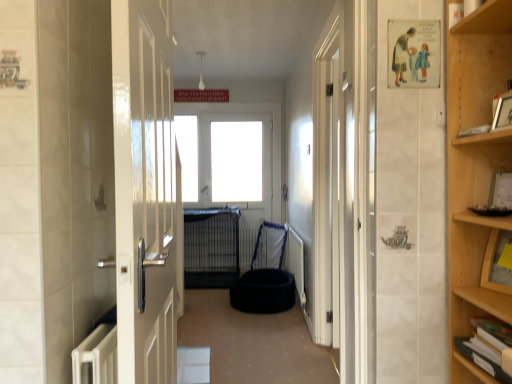
Image resolution: width=512 pixels, height=384 pixels. Identify the location of white glossy door at center. (145, 191).

Measure the distance between point (269,144) and camera.

5.23 meters.

The width and height of the screenshot is (512, 384). In order to click on black fabric bean bag at center in this screenshot , I will do `click(265, 276)`.

What do you see at coordinates (211, 247) in the screenshot?
I see `black wire cage at center` at bounding box center [211, 247].

What do you see at coordinates (263, 291) in the screenshot?
I see `dark blue plush dog bed at center` at bounding box center [263, 291].

Find the location of a particular element. The width and height of the screenshot is (512, 384). white glossy door at center is located at coordinates (145, 191).

Consider the image. From a real-world perspective, between wooden picture frame at upper right and white paper at upper right, marked as the 2th book in a bottom-to-top arrangement, who is vertically higher?

wooden picture frame at upper right.

From the image's perspective, is wooden picture frame at upper right under white paper at upper right, which is counted as the first book, starting from the top?

Incorrect, from the image's perspective, wooden picture frame at upper right is higher than white paper at upper right, which is counted as the first book, starting from the top.

The image size is (512, 384). I want to click on picture frame in front of the white paper at upper right, which is counted as the first book, starting from the top, so click(503, 112).

Can we say white paper at upper right, marked as the 2th book in a bottom-to-top arrangement, lies outside hardcover book at lower right, which is the 1th book from bottom to top?

Indeed, white paper at upper right, marked as the 2th book in a bottom-to-top arrangement, is completely outside hardcover book at lower right, which is the 1th book from bottom to top.

Which is more to the left, white paper at upper right, which is counted as the first book, starting from the top, or hardcover book at lower right, which is the 1th book from bottom to top?

From the viewer's perspective, white paper at upper right, which is counted as the first book, starting from the top, appears more on the left side.

How much distance is there between white paper at upper right, marked as the 2th book in a bottom-to-top arrangement, and hardcover book at lower right, which is the 1th book from bottom to top?

The distance of white paper at upper right, marked as the 2th book in a bottom-to-top arrangement, from hardcover book at lower right, which is the 1th book from bottom to top, is 26.36 inches.

You are a GUI agent. You are given a task and a screenshot of the screen. Output one action in this format:
    pyautogui.click(x=<x>, y=<y>)
    Task: Click on the book below the white paper at upper right, marked as the 2th book in a bottom-to-top arrangement (from a real-world perspective)
    This screenshot has height=384, width=512.
    Given the screenshot: What is the action you would take?
    pyautogui.click(x=487, y=346)

Which is behind, black fabric bean bag at center or hardcover book at lower right, which is the 2th book in top-to-bottom order?

black fabric bean bag at center is further away from the camera.

Which object is thinner, black fabric bean bag at center or hardcover book at lower right, which is the 2th book in top-to-bottom order?

hardcover book at lower right, which is the 2th book in top-to-bottom order.

Considering the positions of objects black fabric bean bag at center and hardcover book at lower right, which is the 2th book in top-to-bottom order, in the image provided, who is more to the left, black fabric bean bag at center or hardcover book at lower right, which is the 2th book in top-to-bottom order,?

black fabric bean bag at center.

From the picture: Do you think black fabric bean bag at center is within hardcover book at lower right, which is the 2th book in top-to-bottom order, or outside of it?

black fabric bean bag at center is located beyond the bounds of hardcover book at lower right, which is the 2th book in top-to-bottom order.

Which is more to the left, black wire cage at center or white glossy window at center?

Positioned to the left is black wire cage at center.

Is black wire cage at center beside white glossy window at center?

No.

Can you confirm if black wire cage at center is thinner than white glossy window at center?

Incorrect, the width of black wire cage at center is not less than that of white glossy window at center.

Between black wire cage at center and white glossy window at center, which one has smaller size?

Smaller between the two is white glossy window at center.

Is black wire cage at center oriented towards white paper at upper right, marked as the 2th book in a bottom-to-top arrangement?

Yes, black wire cage at center is oriented towards white paper at upper right, marked as the 2th book in a bottom-to-top arrangement.

Looking at this image, can you confirm if black wire cage at center is positioned to the left of white paper at upper right, which is counted as the first book, starting from the top?

Indeed, black wire cage at center is positioned on the left side of white paper at upper right, which is counted as the first book, starting from the top.

Is point (189, 239) closer or farther from the camera than point (481, 125)?

Point (189, 239) is positioned farther from the camera compared to point (481, 125).

From the image's perspective, is dark blue plush dog bed at center under wooden picture frame at upper right?

Yes, from the image's perspective, dark blue plush dog bed at center is below wooden picture frame at upper right.

From a real-world perspective, is dark blue plush dog bed at center positioned above or below wooden picture frame at upper right?

dark blue plush dog bed at center is situated lower than wooden picture frame at upper right in the real world.

Is dark blue plush dog bed at center looking in the opposite direction of wooden picture frame at upper right?

dark blue plush dog bed at center does not have its back to wooden picture frame at upper right.

Is point (291, 287) closer to camera compared to point (507, 102)?

No, (291, 287) is further to viewer.

Is white plastic radiator at lower center not close to white glossy door at center?

white plastic radiator at lower center is far away from white glossy door at center.

Looking at their sizes, would you say white plastic radiator at lower center is wider or thinner than white glossy door at center?

In the image, white plastic radiator at lower center appears to be more narrow than white glossy door at center.

Considering the positions of objects white plastic radiator at lower center and white glossy door at center in the image provided, who is more to the right, white plastic radiator at lower center or white glossy door at center?

From the viewer's perspective, white plastic radiator at lower center appears more on the right side.

From the image's perspective, which object appears higher, white plastic radiator at lower center or white glossy door at center?

white glossy door at center appears higher in the image.

There is a wooden picture frame at upper right. At what (x,y) coordinates should I click in order to perform the action: click on the 1st book below it (from the image's perspective). Please return your answer as a coordinate pair (x, y). This screenshot has width=512, height=384. Looking at the image, I should click on (475, 130).

The height and width of the screenshot is (384, 512). I want to click on book lying above the hardcover book at lower right, which is the 1th book from bottom to top (from the image's perspective), so click(475, 130).

From the image, which object appears to be nearer to white paper at upper right, marked as the 2th book in a bottom-to-top arrangement, dark blue plush dog bed at center or white glossy window at center?

dark blue plush dog bed at center.

When comparing their distances from white plastic radiator at lower center, does white glossy window at center or hardcover book at lower right, which is the 1th book from bottom to top, seem further?

Among the two, hardcover book at lower right, which is the 1th book from bottom to top, is located further to white plastic radiator at lower center.

Looking at the image, which one is located closer to white paper at upper right, marked as the 2th book in a bottom-to-top arrangement, white glossy window at center or white glossy door at center?

white glossy door at center lies closer to white paper at upper right, marked as the 2th book in a bottom-to-top arrangement, than the other object.

From the image, which object appears to be farther from wooden picture frame at upper right, white plastic radiator at lower center or hardcover book at lower right, which is the 1th book from bottom to top?

white plastic radiator at lower center.

Considering their positions, is black wire cage at center positioned further to white glossy door at center than white glossy window at center?

white glossy window at center lies further to white glossy door at center than the other object.

Which object lies further to the anchor point white paper at upper right, marked as the 2th book in a bottom-to-top arrangement, black fabric bean bag at center or hardcover book at lower right, which is the 1th book from bottom to top?

black fabric bean bag at center is further to white paper at upper right, marked as the 2th book in a bottom-to-top arrangement.

From the image, which object appears to be nearer to white glossy door at center, white glossy window at center or black fabric bean bag at center?

black fabric bean bag at center is positioned closer to the anchor white glossy door at center.

Based on their spatial positions, is white glossy door at center or white plastic radiator at lower center further from white glossy window at center?

white glossy door at center.

At what (x,y) coordinates should I click in order to perform the action: click on dog bed between white paper at upper right, which is counted as the first book, starting from the top, and black fabric bean bag at center, along the z-axis. Please return your answer as a coordinate pair (x, y). The width and height of the screenshot is (512, 384). Looking at the image, I should click on (263, 291).

The image size is (512, 384). I want to click on dog bed between white plastic radiator at lower center and black fabric bean bag at center from front to back, so tap(263, 291).

Identify the location of radiator between white glossy door at center and white glossy window at center along the z-axis. (296, 261).

Find the location of a particular element. This screenshot has width=512, height=384. radiator located between hardcover book at lower right, which is the 2th book in top-to-bottom order, and dark blue plush dog bed at center in the depth direction is located at coordinates (296, 261).